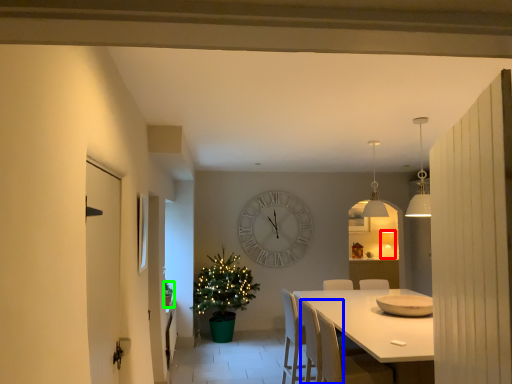
Question: Considering the real-world distances, which object is closest to lamp (highlighted by a red box)? armchair (highlighted by a blue box) or houseplant (highlighted by a green box).

Choices:
 (A) armchair
 (B) houseplant

Answer: (A)